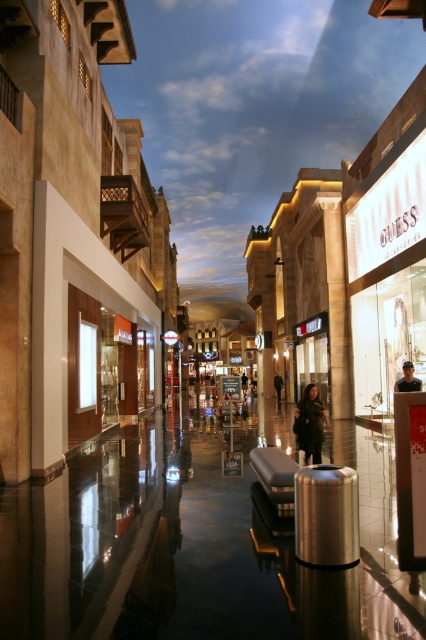
Is dark green leather jacket at center thinner than light brown leather jacket at center?

Correct, dark green leather jacket at center's width is less than light brown leather jacket at center's.

Looking at this image, who is lower down, dark green leather jacket at center or light brown leather jacket at center?

dark green leather jacket at center is below.

What do you see at coordinates (310, 422) in the screenshot? I see `dark green leather jacket at center` at bounding box center [310, 422].

Where is `dark green leather jacket at center`? The width and height of the screenshot is (426, 640). dark green leather jacket at center is located at coordinates (310, 422).

Who is higher up, dark green leather jacket at center or dark brown leather jacket at center?

Positioned higher is dark green leather jacket at center.

Is dark green leather jacket at center wider than dark brown leather jacket at center?

Yes.

Where is `dark green leather jacket at center`? This screenshot has width=426, height=640. dark green leather jacket at center is located at coordinates (310, 422).

Can you confirm if light brown leather jacket at center is bigger than dark brown leather jacket at center?

Indeed, light brown leather jacket at center has a larger size compared to dark brown leather jacket at center.

Between light brown leather jacket at center and dark brown leather jacket at center, which one has more height?

dark brown leather jacket at center is taller.

Does point (412, 378) lie behind point (279, 394)?

No, (412, 378) is in front of (279, 394).

Find the location of a particular element. Image resolution: width=426 pixels, height=640 pixels. light brown leather jacket at center is located at coordinates (408, 380).